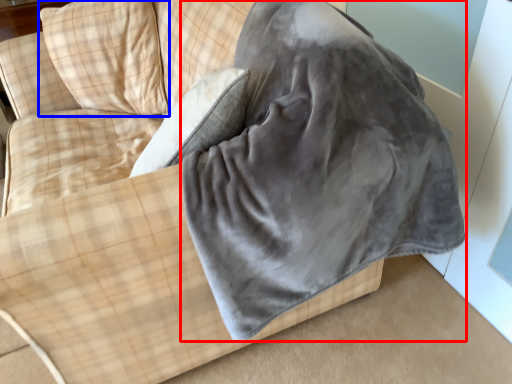
Question: Among these objects, which one is farthest to the camera, sleeping bag (highlighted by a red box) or pillow (highlighted by a blue box)?

Choices:
 (A) sleeping bag
 (B) pillow

Answer: (B)